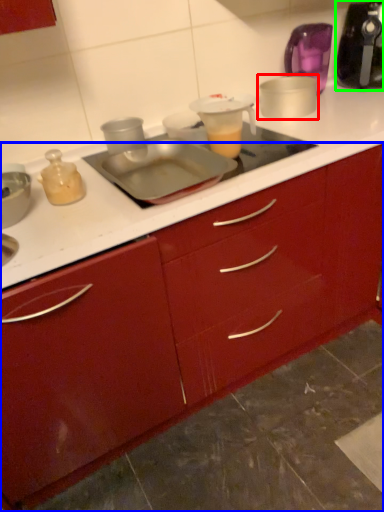
Question: Based on their relative distances, which object is nearer to appliance (highlighted by a red box)? Choose from cabinetry (highlighted by a blue box) and kitchen appliance (highlighted by a green box).

Choices:
 (A) cabinetry
 (B) kitchen appliance

Answer: (B)